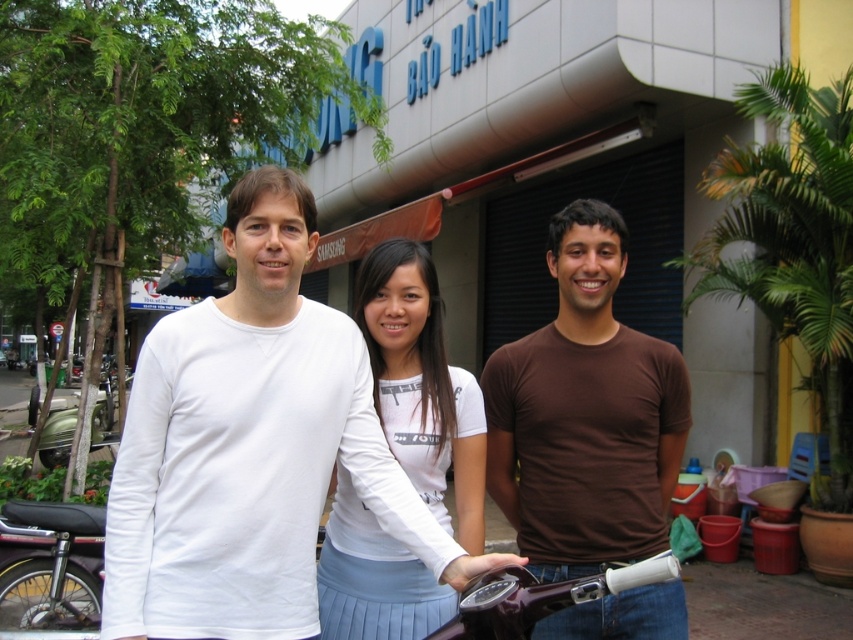
Who is taller, white matte shirt at center or white cotton shirt at center?

With more height is white matte shirt at center.

Between point (161, 605) and point (422, 308), which one is positioned behind?

Positioned behind is point (422, 308).

You are a GUI agent. You are given a task and a screenshot of the screen. Output one action in this format:
    pyautogui.click(x=<x>, y=<y>)
    Task: Click on the white matte shirt at center
    The image size is (853, 640).
    Given the screenshot: What is the action you would take?
    pyautogui.click(x=251, y=448)

Does brown cotton t-shirt at center have a greater width compared to white cotton shirt at center?

Correct, the width of brown cotton t-shirt at center exceeds that of white cotton shirt at center.

Identify the location of brown cotton t-shirt at center. (585, 413).

Who is higher up, white matte shirt at center or brown cotton t-shirt at center?

white matte shirt at center

Measure the distance from white matte shirt at center to brown cotton t-shirt at center.

A distance of 20.74 inches exists between white matte shirt at center and brown cotton t-shirt at center.

What do you see at coordinates (251, 448) in the screenshot? I see `white matte shirt at center` at bounding box center [251, 448].

Locate an element on the screen. white matte shirt at center is located at coordinates (251, 448).